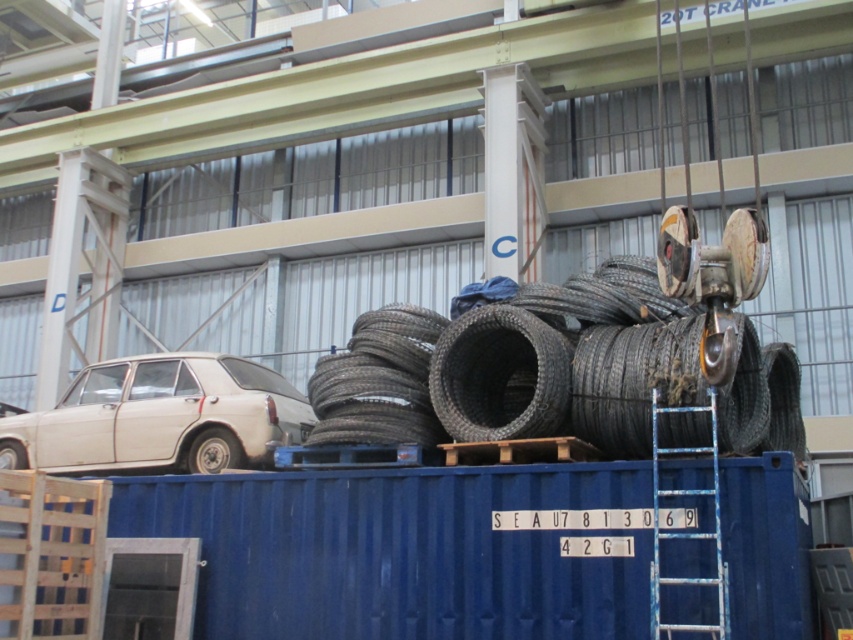
Question: Does black rubber tire at center lie behind blue metallic ladder at right?

Choices:
 (A) yes
 (B) no

Answer: (A)

Question: Which of these objects is positioned closest to the white matte car at left?

Choices:
 (A) blue metallic ladder at right
 (B) black rubber tire at center
 (C) dark gray rubber tire at center
 (D) black rubber tire at lower left

Answer: (D)

Question: Estimate the real-world distances between objects in this image. Which object is farther from the white matte car at left?

Choices:
 (A) black rubber tire at lower left
 (B) dark gray rubber tire at center
 (C) black rubber tire at center
 (D) blue metallic ladder at right

Answer: (D)

Question: Which point is closer to the camera?

Choices:
 (A) (461, 436)
 (B) (227, 429)

Answer: (A)

Question: Observing the image, what is the correct spatial positioning of dark gray rubber tire at center in reference to black rubber tire at lower left?

Choices:
 (A) below
 (B) above

Answer: (B)

Question: Observing the image, what is the correct spatial positioning of black rubber tire at center in reference to black rubber tire at lower left?

Choices:
 (A) below
 (B) above

Answer: (B)